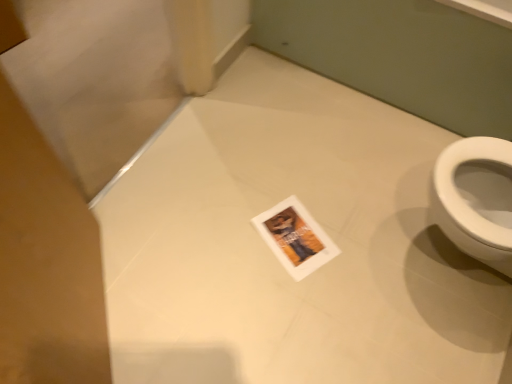
This screenshot has height=384, width=512. I want to click on vacant area on top of white paper postcard at center (from a real-world perspective), so pyautogui.click(x=284, y=234).